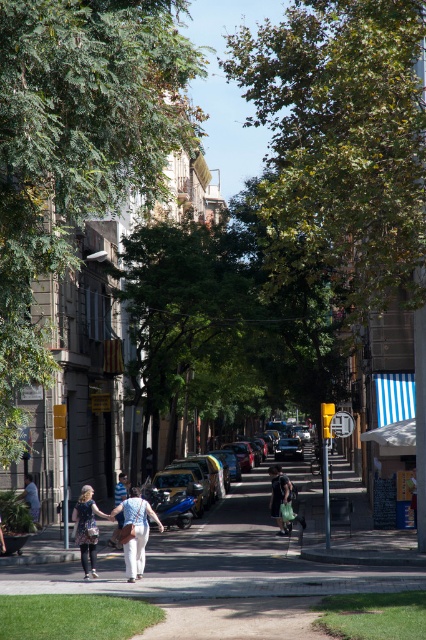
You are a pedestrian standing on the sidewalk in the image. You notice a light blue shirt at center and a light blue denim jacket at lower left. Which clothing item is nearer to you?

The light blue shirt at center is closer to the viewer than the light blue denim jacket at lower left.

You are a pedestrian standing on the sidewalk in this urban scene. You see a denim skirt at center and a black matte jacket at center. Which item is positioned to the left?

The denim skirt at center is to the left of the black matte jacket at center.

You are a photographer standing on the sidewalk of this European street, aiming to capture both the black matte jacket at center and the light blue shirt at center in a single shot. Which clothing item will appear closer to the camera in your photo?

The black matte jacket at center will appear closer to the camera in your photo because it is positioned further to the viewer than the light blue shirt at center.